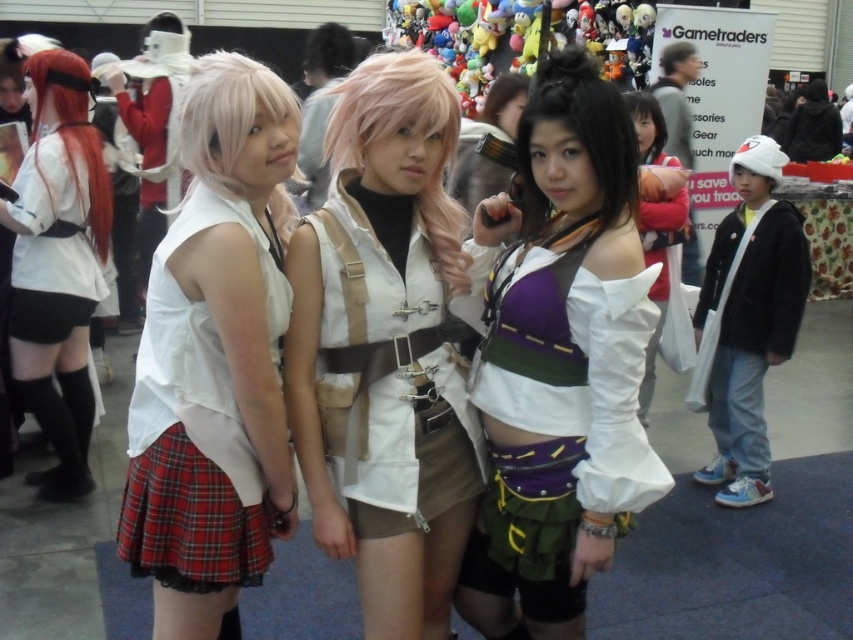
Question: Does purple fabric top at center have a greater width compared to pink synthetic wig at center?

Choices:
 (A) no
 (B) yes

Answer: (B)

Question: Considering the real-world distances, which object is farthest from the black matte wig at upper center?

Choices:
 (A) black matte wig at center
 (B) white satin dress at center

Answer: (A)

Question: Estimate the real-world distances between objects in this image. Which object is closer to the blonde synthetic wig at center?

Choices:
 (A) satin black wig at center
 (B) white satin dress at center
 (C) pink synthetic wig at center
 (D) matte white shirt at center

Answer: (C)

Question: Is white matte skirt at center thinner than matte white shirt at left?

Choices:
 (A) yes
 (B) no

Answer: (B)

Question: Can you confirm if pink synthetic wig at center is positioned to the left of white satin dress at center?

Choices:
 (A) no
 (B) yes

Answer: (B)

Question: Estimate the real-world distances between objects in this image. Which object is farther from the purple fabric top at center?

Choices:
 (A) matte white shirt at center
 (B) black matte wig at upper center
 (C) satin black wig at center
 (D) shiny red wig at left

Answer: (B)